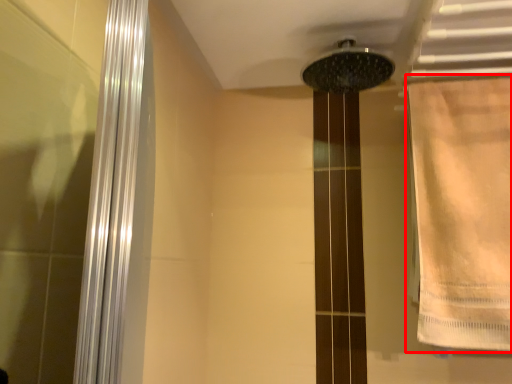
Question: From the image's perspective, what is the correct spatial relationship of shower curtain (annotated by the red box) in relation to shower?

Choices:
 (A) below
 (B) above

Answer: (A)